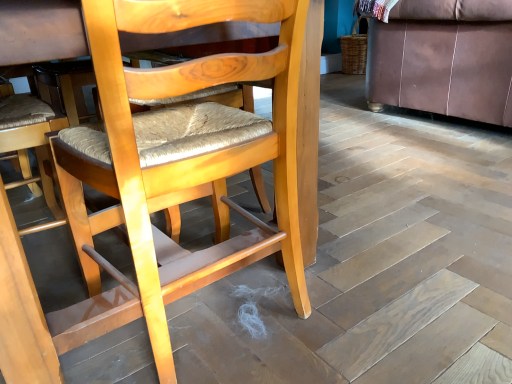
Question: From a real-world perspective, is brown leather couch at right above or below light brown wood chair at center?

Choices:
 (A) below
 (B) above

Answer: (B)

Question: Is point (429, 72) closer or farther from the camera than point (198, 67)?

Choices:
 (A) farther
 (B) closer

Answer: (A)

Question: Visually, is brown leather couch at right positioned to the left or to the right of light brown wood chair at center?

Choices:
 (A) left
 (B) right

Answer: (B)

Question: Visually, is light brown wood chair at center positioned to the left or to the right of brown leather couch at right?

Choices:
 (A) right
 (B) left

Answer: (B)

Question: From the image's perspective, is light brown wood chair at center above or below brown leather couch at right?

Choices:
 (A) above
 (B) below

Answer: (B)

Question: From a real-world perspective, is light brown wood chair at center physically located above or below brown leather couch at right?

Choices:
 (A) below
 (B) above

Answer: (A)

Question: Is light brown wood chair at center taller or shorter than brown leather couch at right?

Choices:
 (A) short
 (B) tall

Answer: (B)